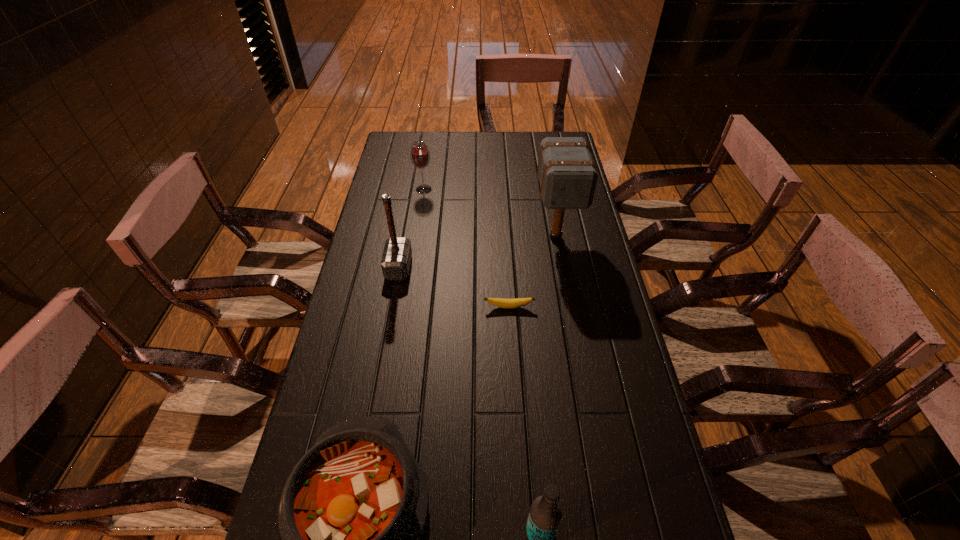
At what (x,y) coordinates should I click in order to perform the action: click on unoccupied position between the banana and the farthest object. Please return your answer as a coordinate pair (x, y). The image size is (960, 540). Looking at the image, I should click on (467, 248).

Identify which object is the fourth nearest to the shortest object. Please provide its 2D coordinates. Your answer should be formatted as a tuple, i.e. [(x, y)], where the tuple contains the x and y coordinates of a point satisfying the conditions above.

[(545, 514)]

Locate which object ranks in proximity to the tallest object. Please provide its 2D coordinates. Your answer should be formatted as a tuple, i.e. [(x, y)], where the tuple contains the x and y coordinates of a point satisfying the conditions above.

[(499, 302)]

Where is `vacant space that satisfies the following two spatial constraints: 1. on the front side of the fourth tallest object; 2. on the striking surface of the hammer`? This screenshot has width=960, height=540. vacant space that satisfies the following two spatial constraints: 1. on the front side of the fourth tallest object; 2. on the striking surface of the hammer is located at coordinates (412, 267).